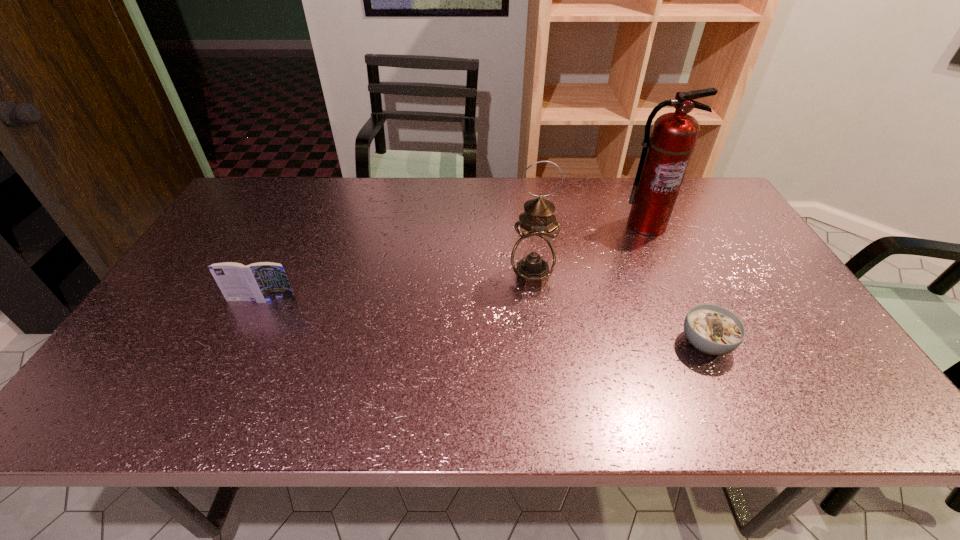
Locate an element on the screen. fire extinguisher is located at coordinates (665, 156).

Identify the location of the farthest object. This screenshot has width=960, height=540. (665, 156).

Identify the location of the second farthest object. This screenshot has height=540, width=960. (533, 258).

Find the location of `oil lamp`. oil lamp is located at coordinates (533, 258).

Locate an element on the screen. The width and height of the screenshot is (960, 540). the leftmost object is located at coordinates (261, 282).

Identify the location of the third farthest object. (261, 282).

The height and width of the screenshot is (540, 960). What are the coordinates of `soup bowl` in the screenshot? It's located at (712, 329).

Locate an element on the screen. The width and height of the screenshot is (960, 540). the shortest object is located at coordinates (712, 329).

The image size is (960, 540). I want to click on vacant area located on the nozzle side of the fire extinguisher, so click(680, 299).

Locate an element on the screen. Image resolution: width=960 pixels, height=540 pixels. free point located 0.210m on the right of the second farthest object is located at coordinates (632, 276).